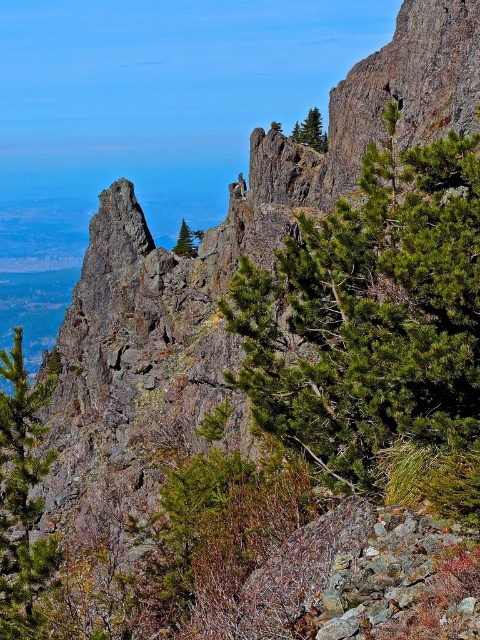
This screenshot has height=640, width=480. What do you see at coordinates (22, 497) in the screenshot? I see `green matte tree at left` at bounding box center [22, 497].

Is point (23, 388) farther from camera compared to point (323, 140)?

No.

The image size is (480, 640). Identify the location of green matte tree at left. (22, 497).

Which is in front, point (263, 314) or point (11, 625)?

Point (11, 625)

Does green needle-like tree at center-right come in front of green matte tree at left?

That is True.

Between point (300, 296) and point (23, 440), which one is positioned in front?

Point (23, 440)

Where is `green needle-like tree at center-right`? The height and width of the screenshot is (640, 480). green needle-like tree at center-right is located at coordinates [370, 314].

Who is more distant from viewer, [312,134] or [183,218]?

Point [183,218]

Can you confirm if green matte tree at upper right is positioned below green matte tree at center?

Actually, green matte tree at upper right is above green matte tree at center.

I want to click on green matte tree at upper right, so click(311, 131).